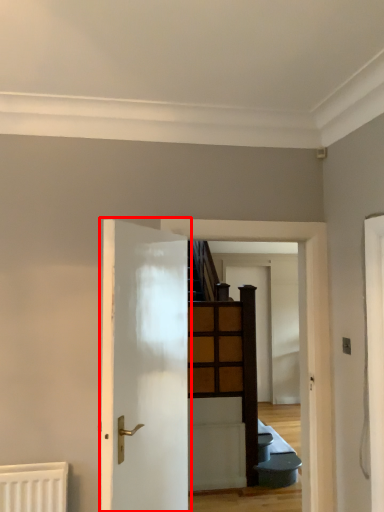
Question: Observing the image, what is the correct spatial positioning of door (annotated by the red box) in reference to door?

Choices:
 (A) right
 (B) left

Answer: (B)